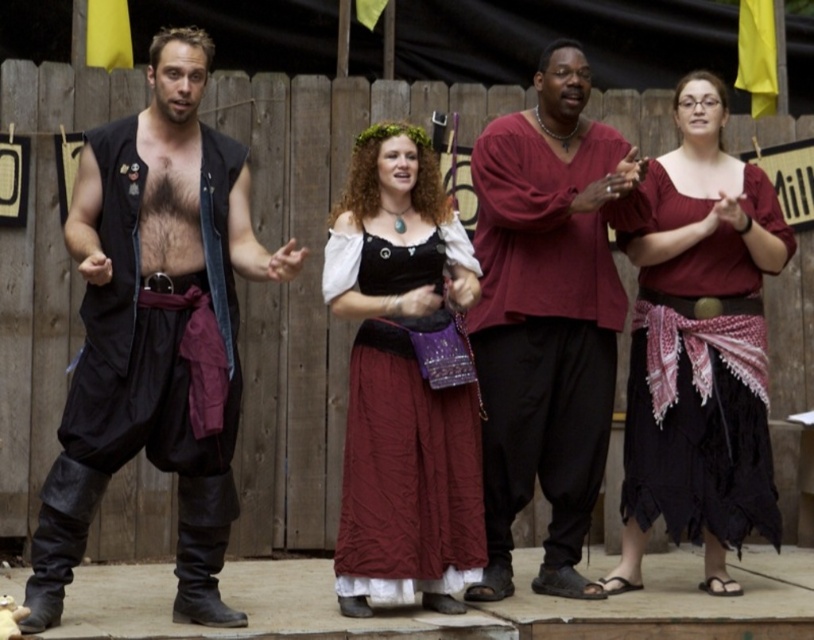
Is leather vest at left above maroon fabric shirt at center?

Incorrect, leather vest at left is not positioned above maroon fabric shirt at center.

Is point (169, 336) closer to camera compared to point (519, 492)?

Yes, it is.

Locate an element on the screen. The height and width of the screenshot is (640, 814). leather vest at left is located at coordinates (155, 330).

Is maroon fabric shirt at center to the left of matte red blouse at center from the viewer's perspective?

Indeed, maroon fabric shirt at center is positioned on the left side of matte red blouse at center.

Which is more to the right, maroon fabric shirt at center or matte red blouse at center?

matte red blouse at center is more to the right.

Is point (502, 216) behind point (714, 422)?

That is False.

The height and width of the screenshot is (640, 814). Find the location of `maroon fabric shirt at center`. maroon fabric shirt at center is located at coordinates (546, 316).

Can you confirm if leather vest at left is positioned below velvet black dress at center?

Actually, leather vest at left is above velvet black dress at center.

Does leather vest at left have a lesser height compared to velvet black dress at center?

No.

Is point (90, 444) more distant than point (366, 612)?

No, it is not.

I want to click on leather vest at left, so click(155, 330).